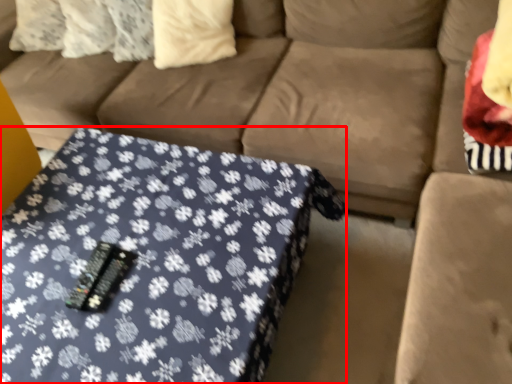
Question: From the image's perspective, where is table (annotated by the red box) located in relation to pillow in the image?

Choices:
 (A) below
 (B) above

Answer: (A)